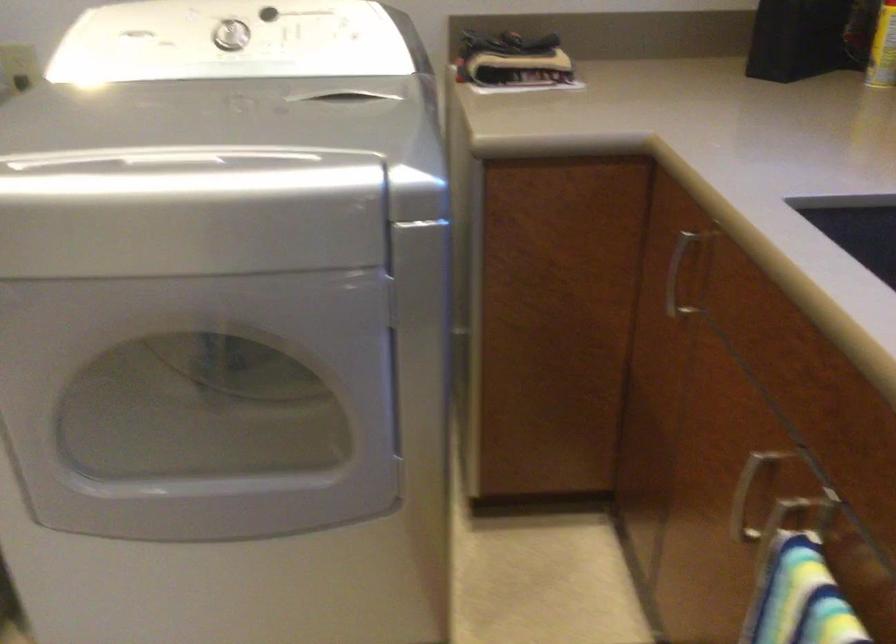
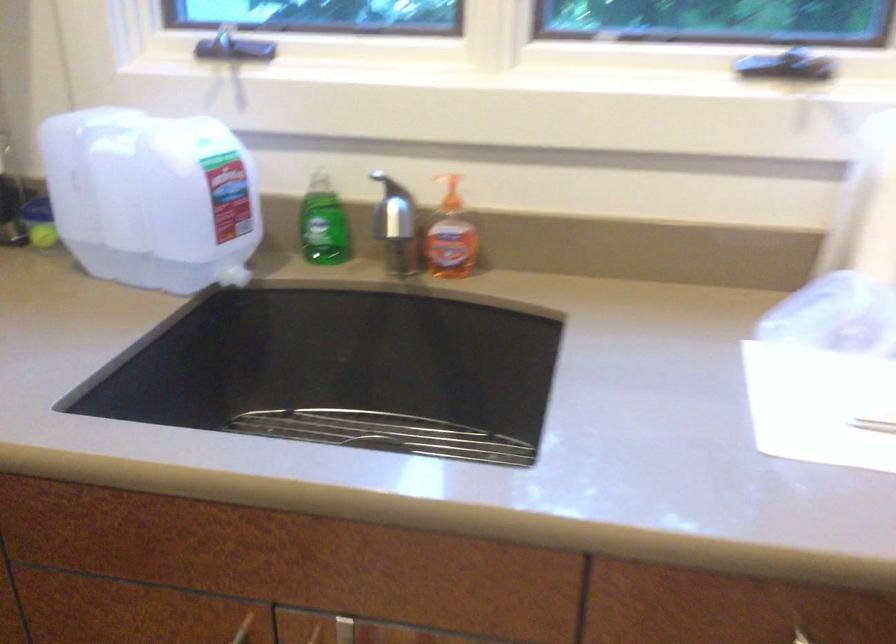
First-person continuous shooting, in which direction is the camera rotating?

The rotation direction of the camera is right-down.